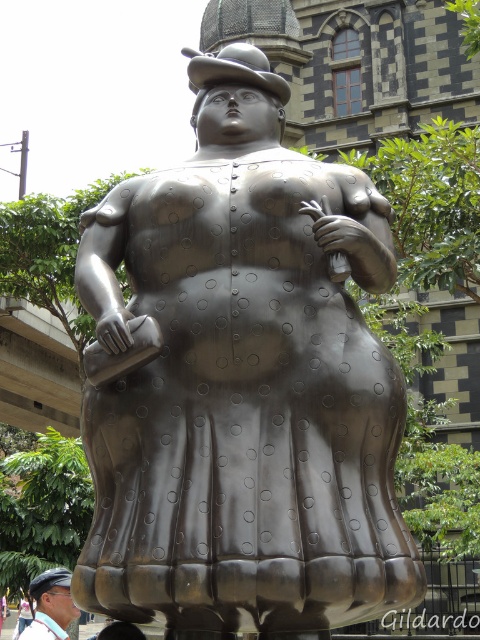
You are standing in front of a large metallic sculpture of a woman. The sculpture is at the center of the image. There is a point marked at coordinates (242,385). Is this point likely part of the sculpture?

The bronze statue at center is represented by point (242,385), so yes, the point is part of the sculpture.